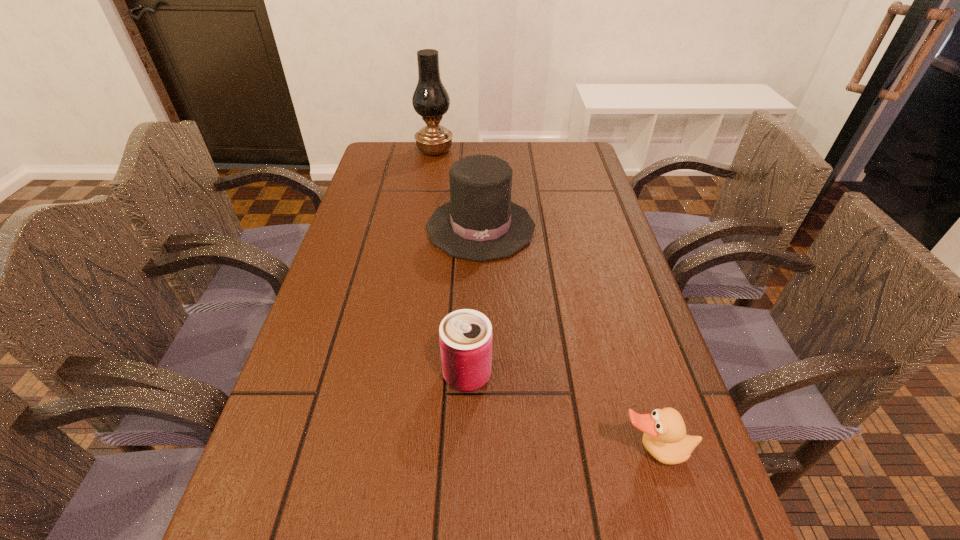
Image resolution: width=960 pixels, height=540 pixels. What are the coordinates of `blank region between the second tallest object and the can` in the screenshot? It's located at (474, 301).

Find the location of a particular element. The height and width of the screenshot is (540, 960). free spot between the third tallest object and the oil lamp is located at coordinates (451, 262).

I want to click on empty location between the duck and the third tallest object, so click(561, 414).

At what (x,y) coordinates should I click in order to perform the action: click on vacant space in between the can and the oil lamp. Please return your answer as a coordinate pair (x, y). The image size is (960, 540). Looking at the image, I should click on (451, 262).

Find the location of `object that stands as the closest to the second nearest object`. object that stands as the closest to the second nearest object is located at coordinates (665, 438).

This screenshot has height=540, width=960. In order to click on object that can be found as the closest to the third farthest object in this screenshot , I will do `click(665, 438)`.